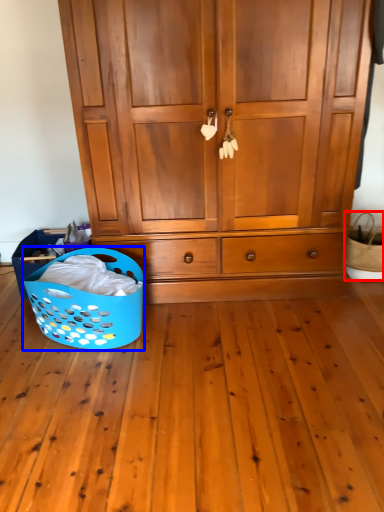
Question: Among these objects, which one is nearest to the camera, basket (highlighted by a red box) or basket (highlighted by a blue box)?

Choices:
 (A) basket
 (B) basket

Answer: (B)